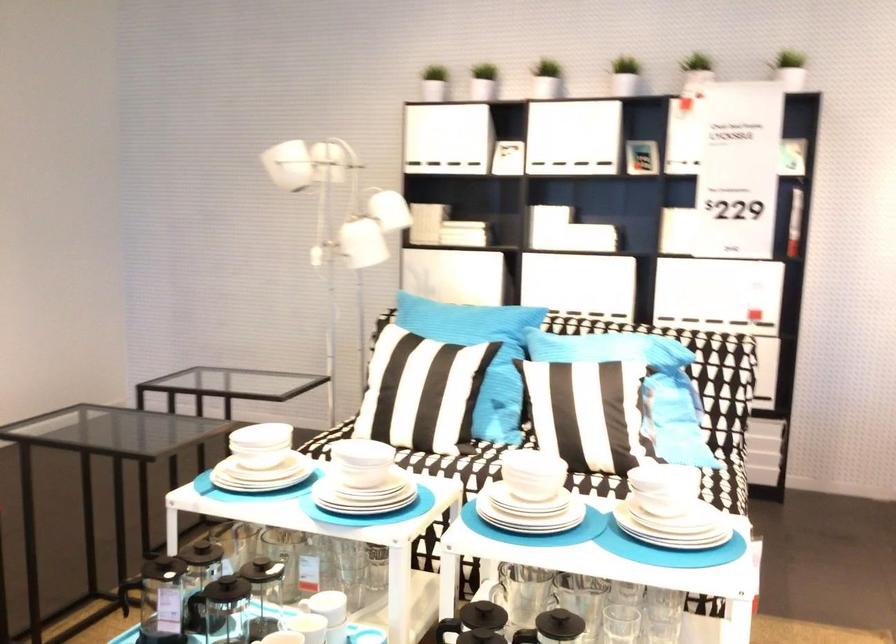
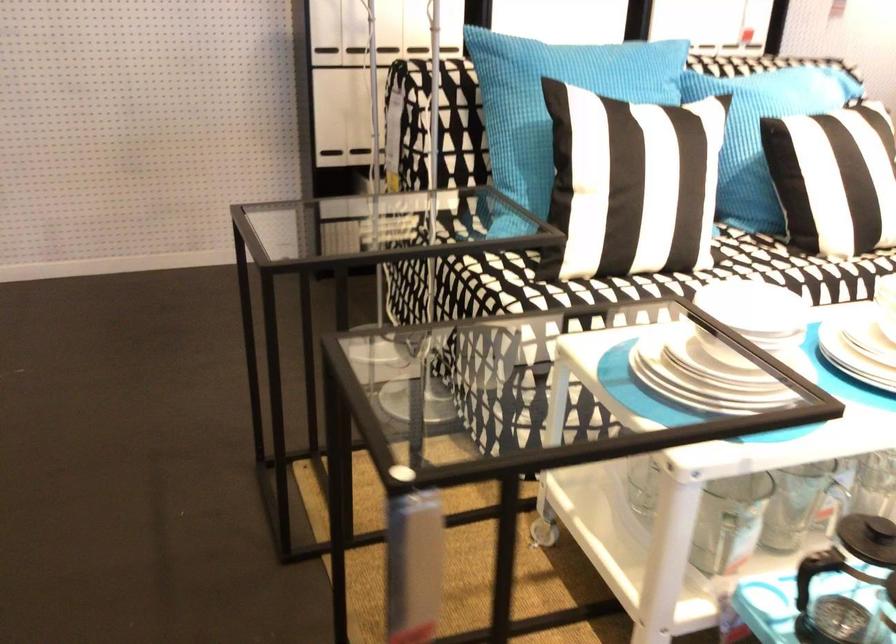
Question: I am providing you with two images of the same scene from different viewpoints. After the viewpoint changes to image2, which objects are now occluded?

Choices:
 (A) black press handle
 (B) white ceramic bowl
 (C) blue pillow
 (D) none of these

Answer: (D)